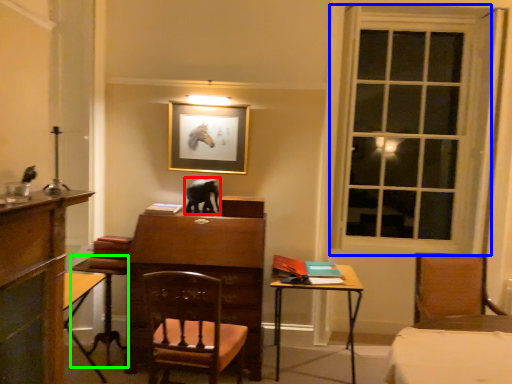
Question: Which object is positioned closest to animal (highlighted by a red box)? Select from window (highlighted by a blue box) and table (highlighted by a green box).

Choices:
 (A) window
 (B) table

Answer: (B)